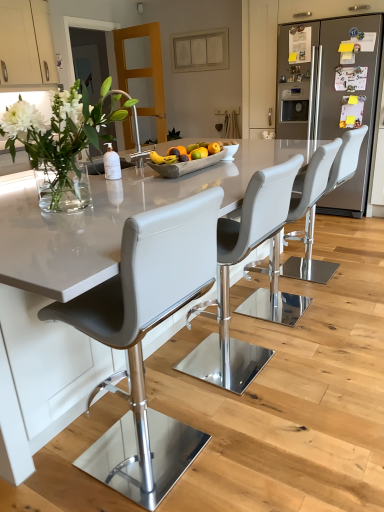
The height and width of the screenshot is (512, 384). I want to click on space that is in front of white leather bar stool at center, acting as the fourth chair starting from the front, so click(340, 297).